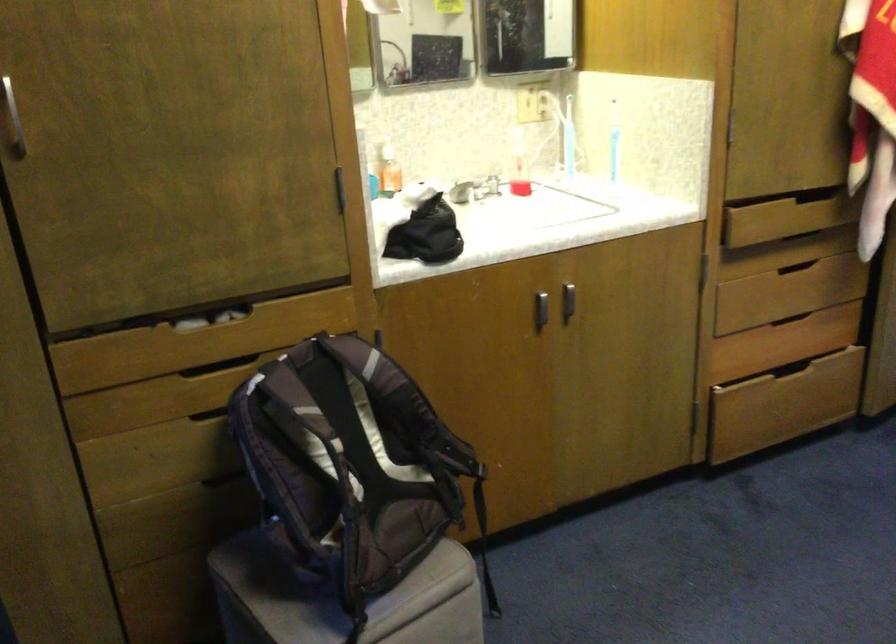
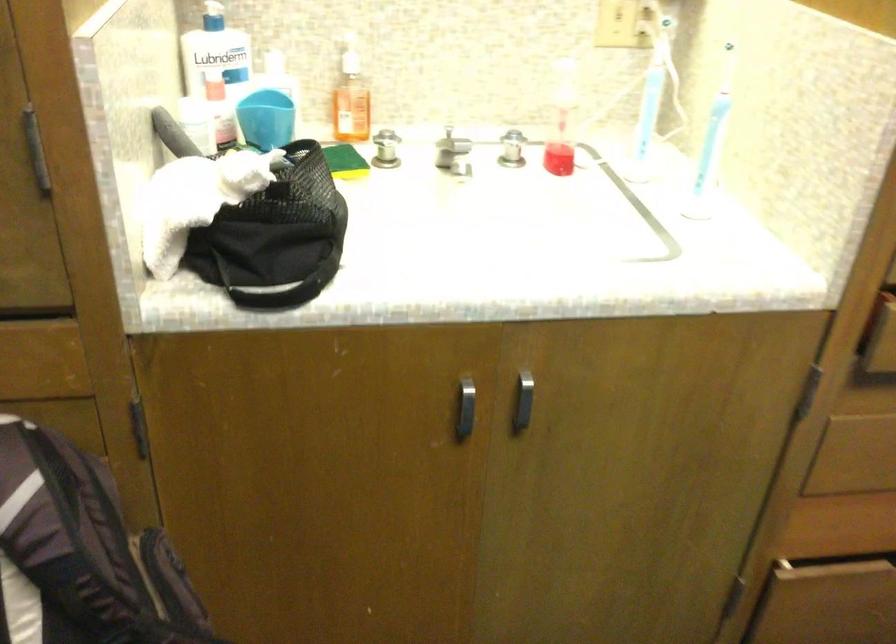
Where in the second image is the point corresponding to the point at 567,298 from the first image?

(522, 402)